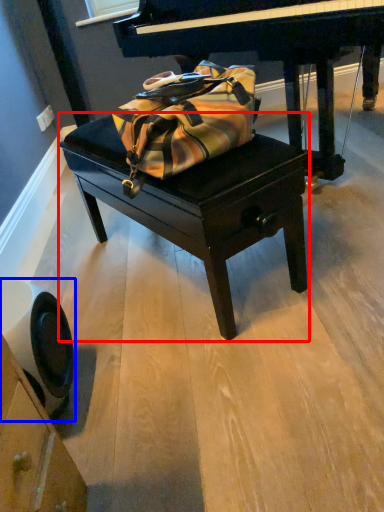
Question: Among these objects, which one is nearest to the camera, table (highlighted by a red box) or swivel chair (highlighted by a blue box)?

Choices:
 (A) table
 (B) swivel chair

Answer: (B)